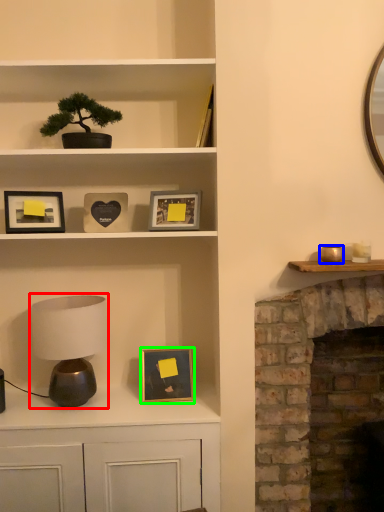
Question: Which object is the farthest from table lamp (highlighted by a red box)? Choose among these: candle holder (highlighted by a blue box) or picture frame (highlighted by a green box).

Choices:
 (A) candle holder
 (B) picture frame

Answer: (A)